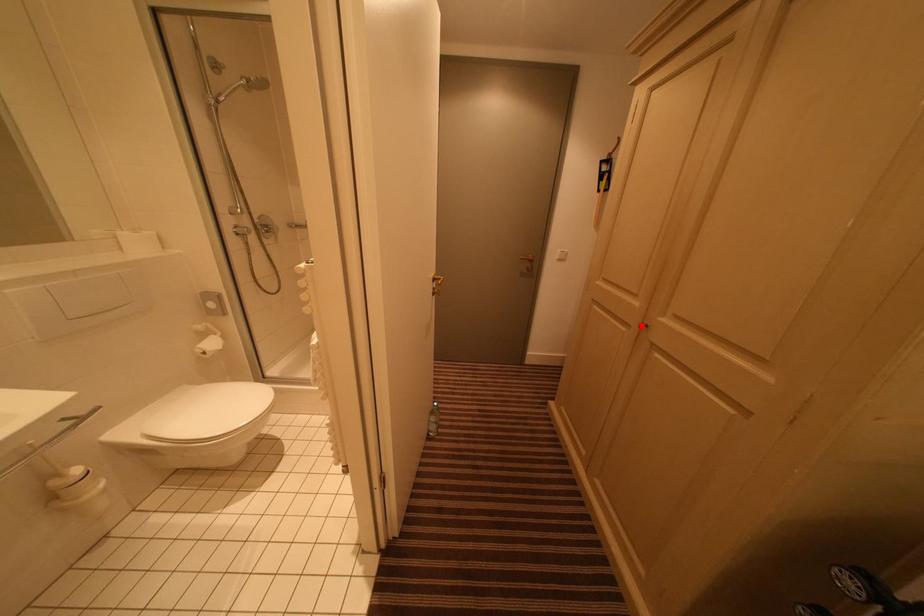
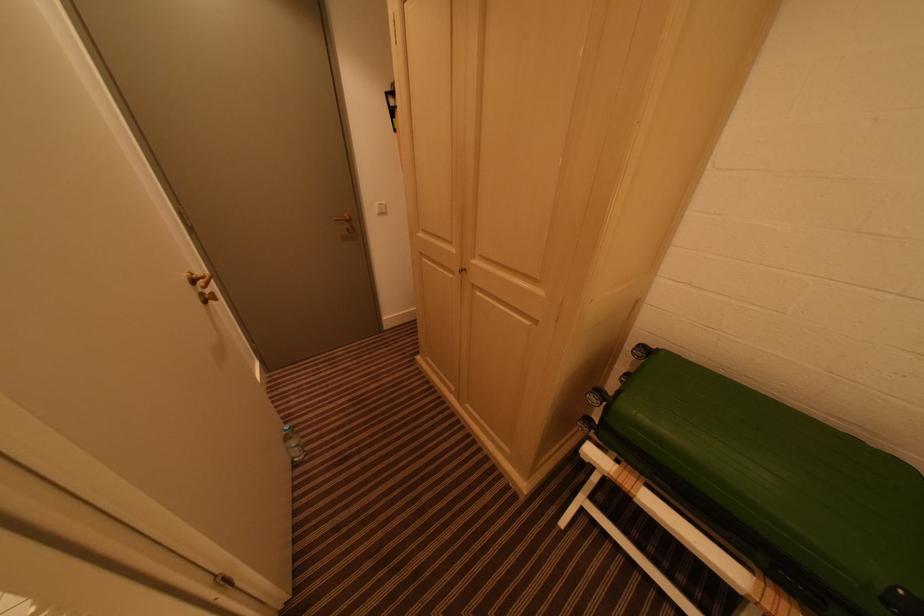
Question: I am providing you with two images of the same scene from different viewpoints. A red point is marked on the first image. Can you still see the location of the red point in image 2?

Choices:
 (A) Yes
 (B) No

Answer: (A)